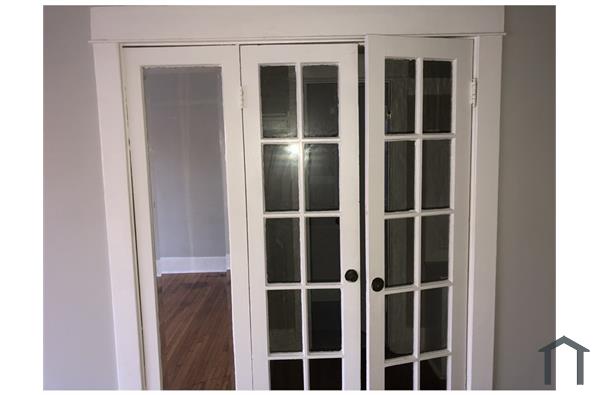
This screenshot has height=395, width=600. Identify the location of main wall. (75, 167).